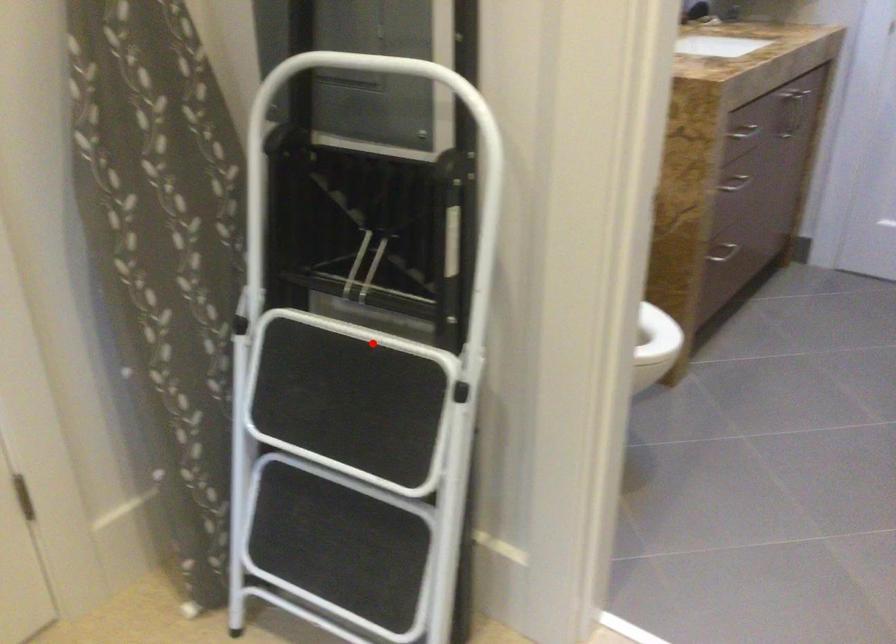
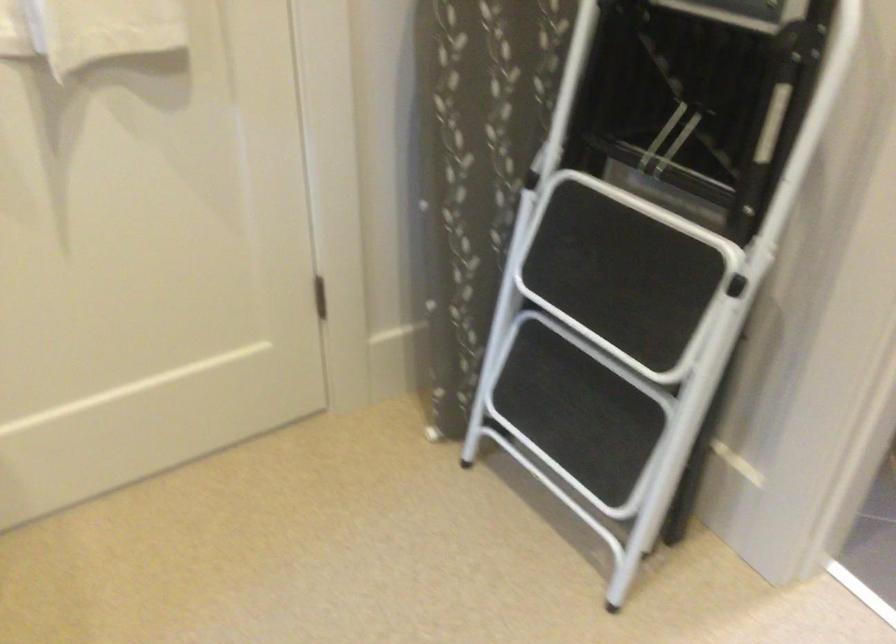
Where in the second image is the point corresponding to the highlighted location from the first image?

(658, 216)